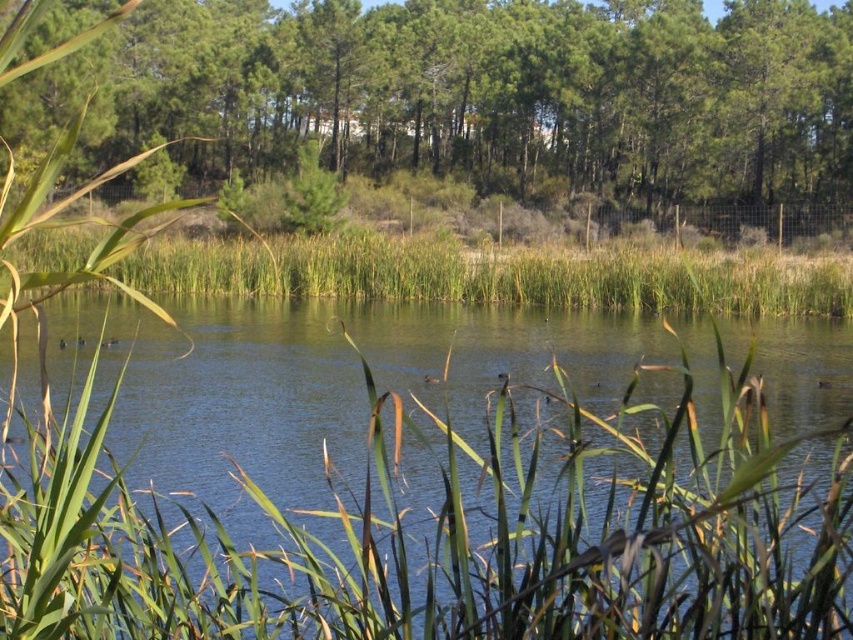
Based on the scene description and the coordinates provided, what does the point at coordinates (428, 497) represent in the image?

The point at coordinates (428, 497) represents the green grassy lake at center.

You are standing at the edge of the pond and want to see the green leafy trees at upper center. Are they positioned higher than the green grass at center?

The green leafy trees at upper center is above green grass at center, so yes, they are positioned higher than the green grass at center.